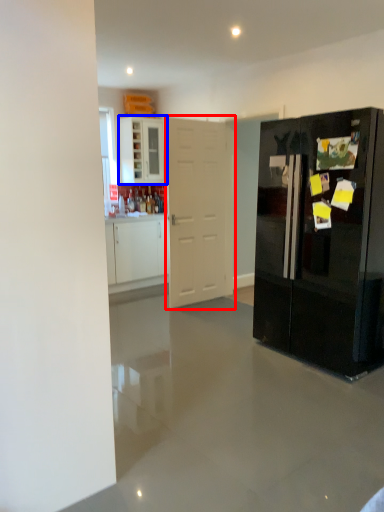
Question: Which of the following is the closest to the observer, door (highlighted by a red box) or cabinetry (highlighted by a blue box)?

Choices:
 (A) door
 (B) cabinetry

Answer: (A)